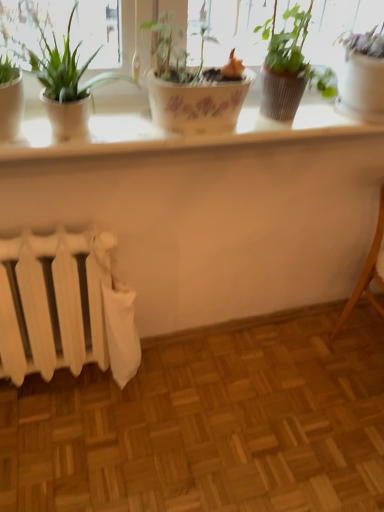
Identify the location of vacant space in light brown wooden chair at lower right (from a real-world perspective). The image size is (384, 512). (365, 340).